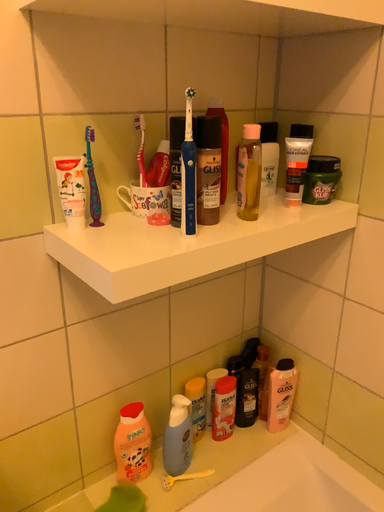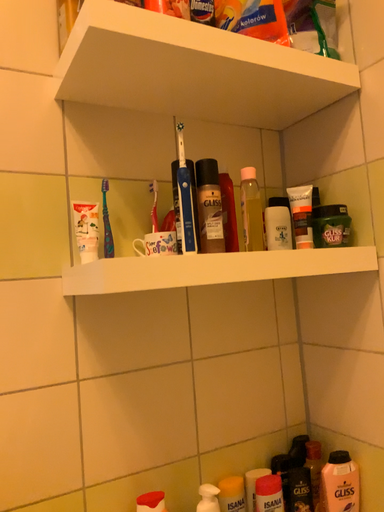
Question: How did the camera likely rotate when shooting the video?

Choices:
 (A) rotated left
 (B) rotated right

Answer: (A)